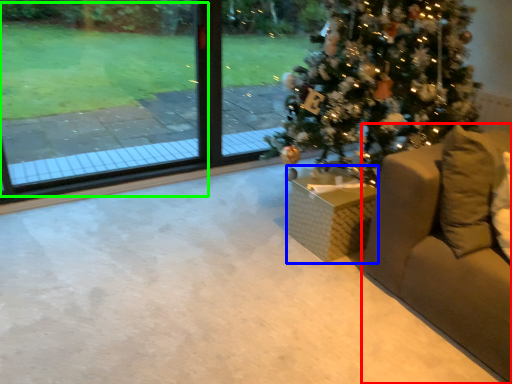
Question: Estimate the real-world distances between objects in this image. Which object is farther from furniture (highlighted by a red box), furniture (highlighted by a blue box) or window screen (highlighted by a green box)?

Choices:
 (A) furniture
 (B) window screen

Answer: (B)